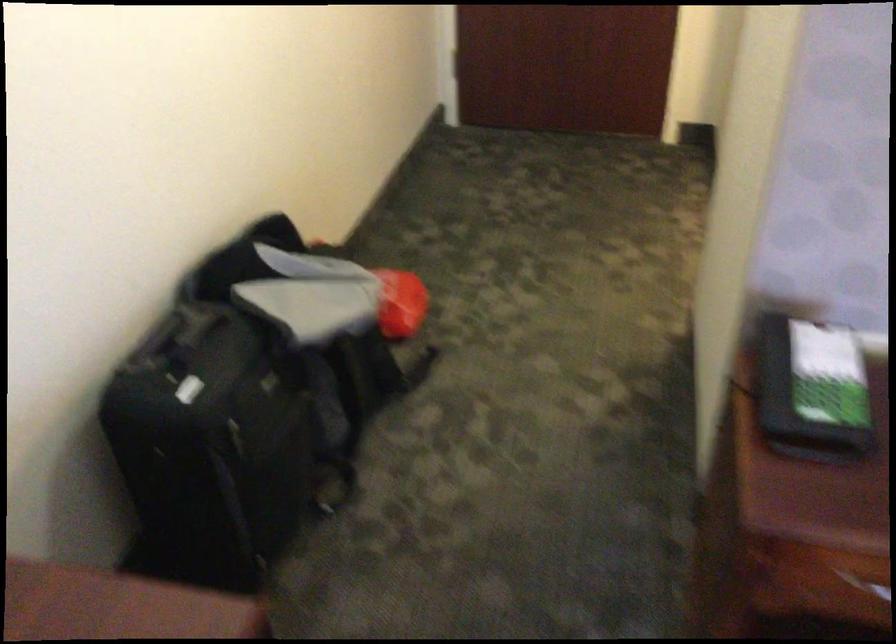
The image size is (896, 644). Identify the location of phone handset. (812, 390).